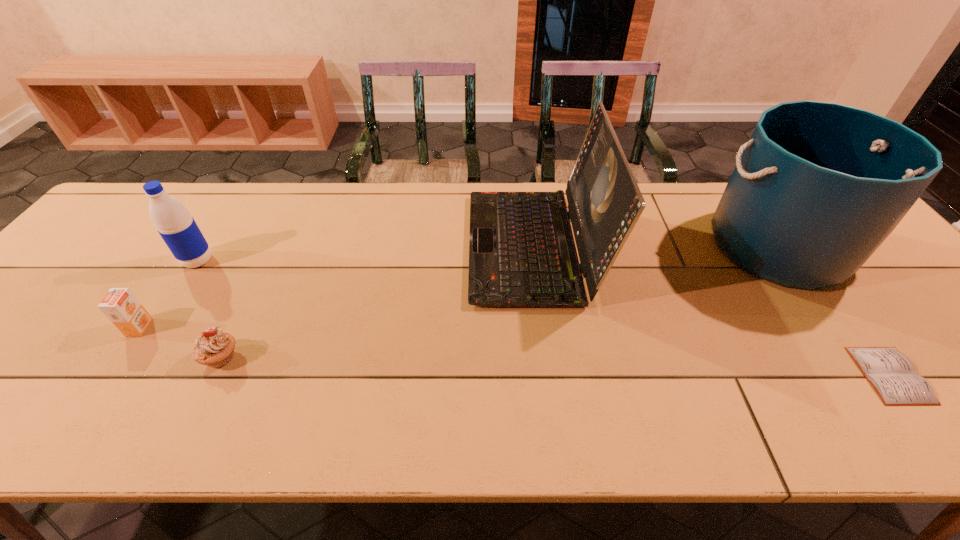
Identify the location of free space between the laptop computer and the fifth tallest object. (376, 302).

Locate an element on the screen. vacant point located between the third tallest object and the shortest object is located at coordinates (544, 318).

Locate an element on the screen. The image size is (960, 540). vacant area between the third tallest object and the fourth object from left to right is located at coordinates (366, 253).

Where is `object that is the fifth closest to the bucket`? object that is the fifth closest to the bucket is located at coordinates (122, 308).

Point out which object is positioned as the second nearest to the fourth object from right to left. Please provide its 2D coordinates. Your answer should be formatted as a tuple, i.e. [(x, y)], where the tuple contains the x and y coordinates of a point satisfying the conditions above.

[(178, 229)]

You are a GUI agent. You are given a task and a screenshot of the screen. Output one action in this format:
    pyautogui.click(x=<x>, y=<y>)
    Task: Click on the free space that satisfies the following two spatial constraints: 1. on the screen of the shortest object; 2. on the right side of the third object from right to left
    
    Given the screenshot: What is the action you would take?
    pyautogui.click(x=549, y=375)